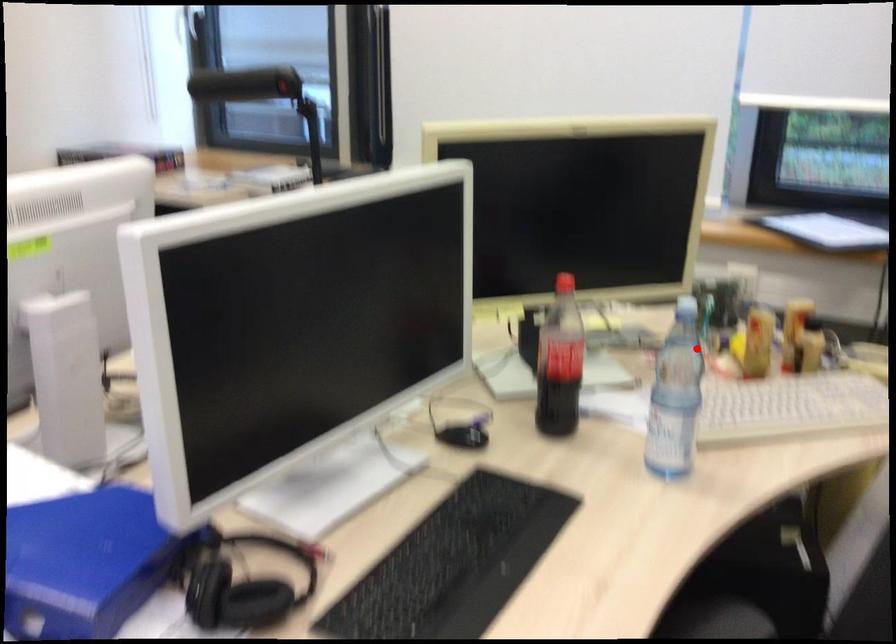
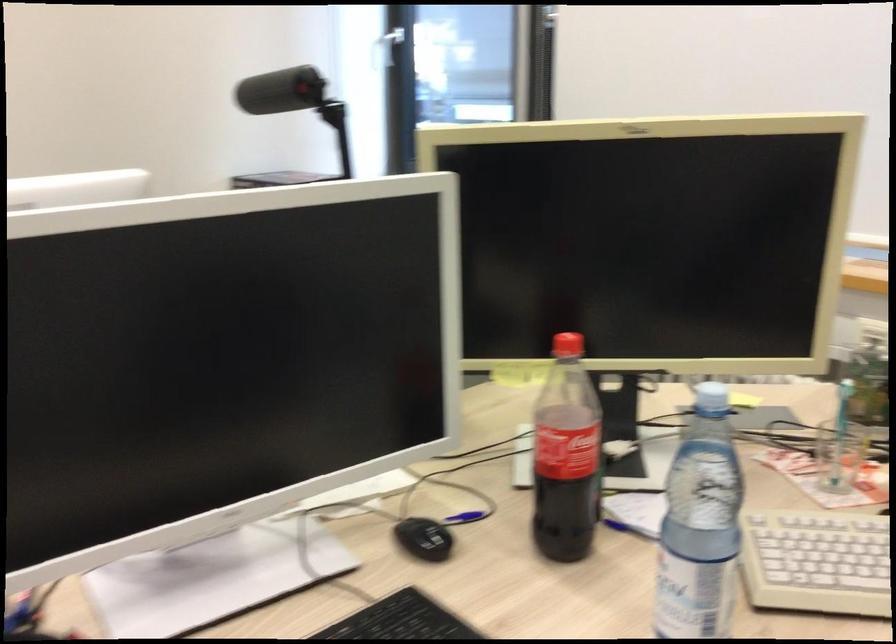
Question: I am providing you with two images of the same scene from different viewpoints. Image1 has a red point marked. In image2, the corresponding 3D location appears at what relative position? Reply with the corresponding letter.

Choices:
 (A) Closer
 (B) Farther

Answer: (A)